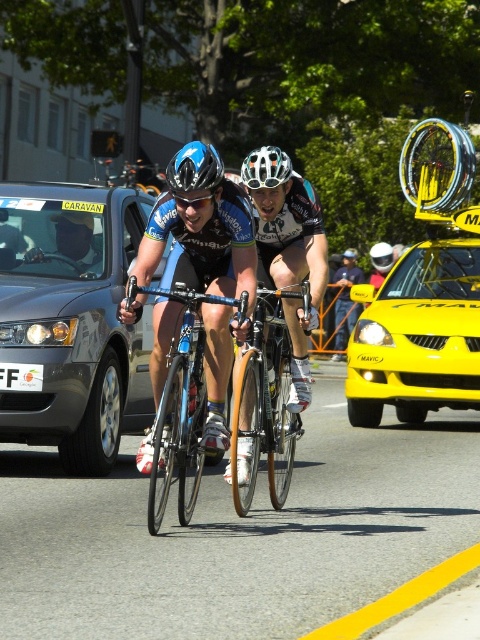
Does matte gray sedan at left appear on the right side of white matte bicycle helmet at center?

No, matte gray sedan at left is not to the right of white matte bicycle helmet at center.

Who is more distant from viewer, (82, 285) or (285, 173)?

The point (82, 285) is more distant.

Who is more forward, (56, 387) or (279, 176)?

Point (279, 176)

What are the coordinates of `matte gray sedan at left` in the screenshot? It's located at (71, 321).

Is shiny blue bicycle at center smaller than blue metallic bicycle at center?

Indeed, shiny blue bicycle at center has a smaller size compared to blue metallic bicycle at center.

The width and height of the screenshot is (480, 640). I want to click on shiny blue bicycle at center, so click(201, 228).

From the picture: Which is more to the left, yellow matte taxi at center or matte black helmet at upper center?

matte black helmet at upper center

Is yellow matte taxi at center bigger than matte black helmet at upper center?

Indeed, yellow matte taxi at center has a larger size compared to matte black helmet at upper center.

The image size is (480, 640). What do you see at coordinates (423, 292) in the screenshot?
I see `yellow matte taxi at center` at bounding box center [423, 292].

In order to click on yellow matte taxi at center in this screenshot , I will do tap(423, 292).